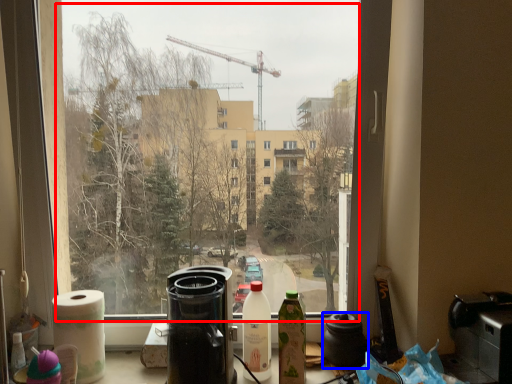
Question: Which of the following is the closest to the observer, bay window (highlighted by a red box) or coffeepot (highlighted by a blue box)?

Choices:
 (A) bay window
 (B) coffeepot

Answer: (A)